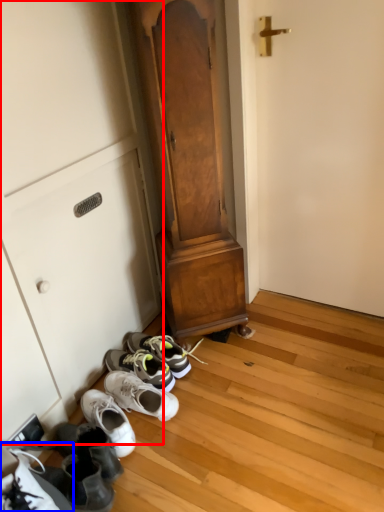
Question: Among these objects, which one is farthest to the camera, cabinetry (highlighted by a red box) or footwear (highlighted by a blue box)?

Choices:
 (A) cabinetry
 (B) footwear

Answer: (A)